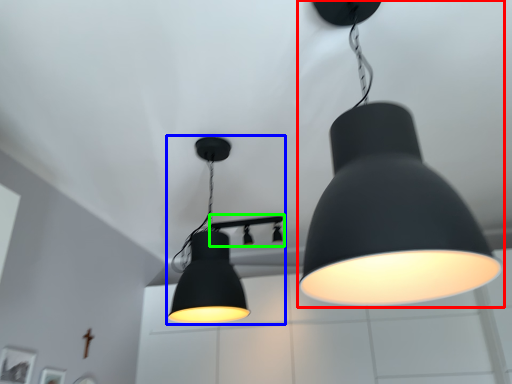
Question: Which object is the closest to the lamp (highlighted by a red box)? Choose among these: lamp (highlighted by a blue box) or lamp (highlighted by a green box).

Choices:
 (A) lamp
 (B) lamp

Answer: (A)